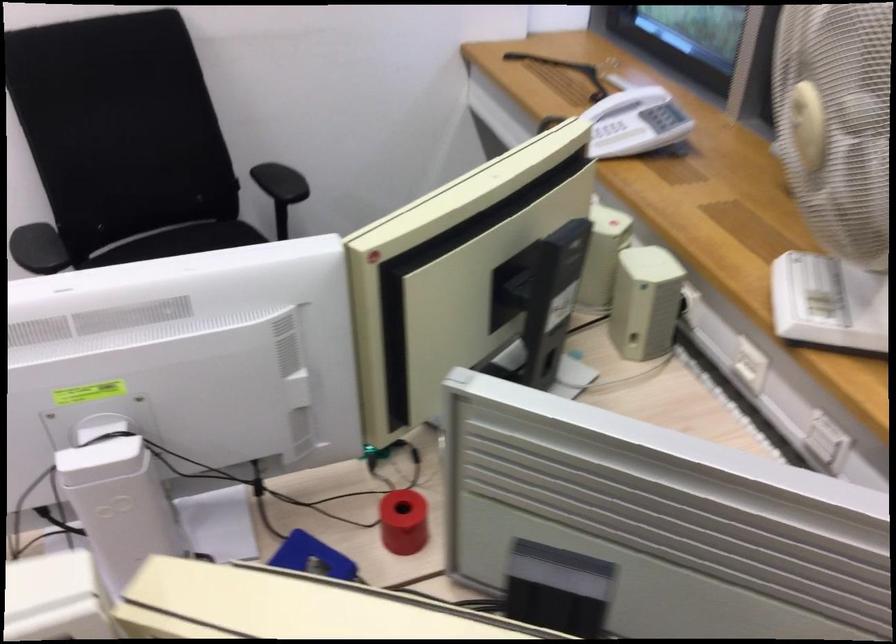
Identify the location of fan control buttons. (617, 138).